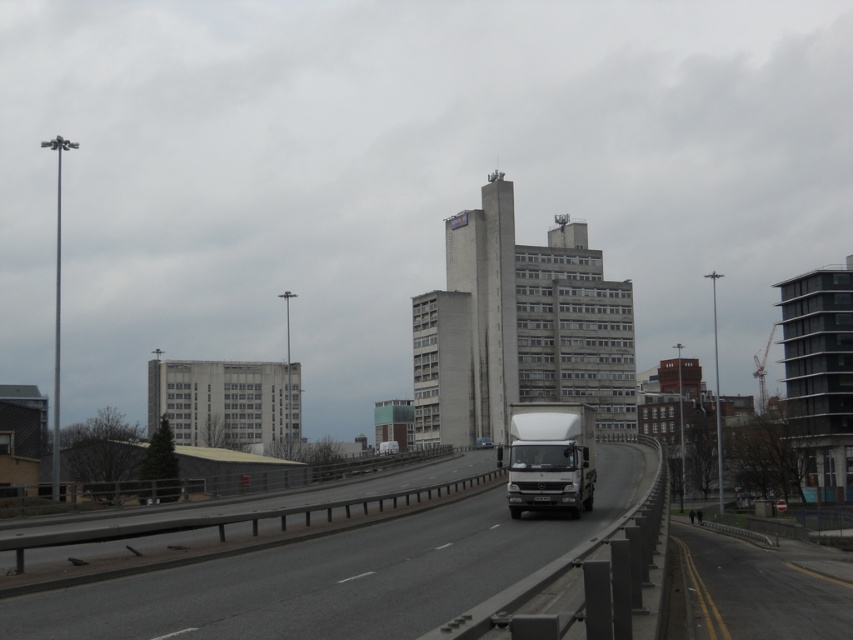
You are a drone operator planning to fly a drone over the urban scene. The drone has a maximum flight height of 10 meters. Considering the smooth asphalt highway at center and the matte white van at center, which object would the drone be able to fly over without exceeding its height limit?

The drone can fly over the matte white van at center because the smooth asphalt highway at center is much taller than the matte white van at center, so the highway might exceed the drone height limit. However, the van is shorter, so the drone can safely fly over it within the 10 meters limit.

You are a delivery driver who needs to pass under a low bridge that has a height restriction of 3 meters. You are currently driving either the white matte trailer truck at center or the matte white van at center. Based on the scene, which vehicle would you choose to safely pass under the bridge?

The matte white van at center has a lower height compared to the white matte trailer truck at center, so choosing the matte white van at center would allow you to safely pass under the 3 meter height restriction.

You are a city planner analyzing the highway layout. You need to place a new traffic camera at point (550, 458). Which object in the scene is exactly at that coordinate?

The white matte trailer truck at center is located at point (550, 458).